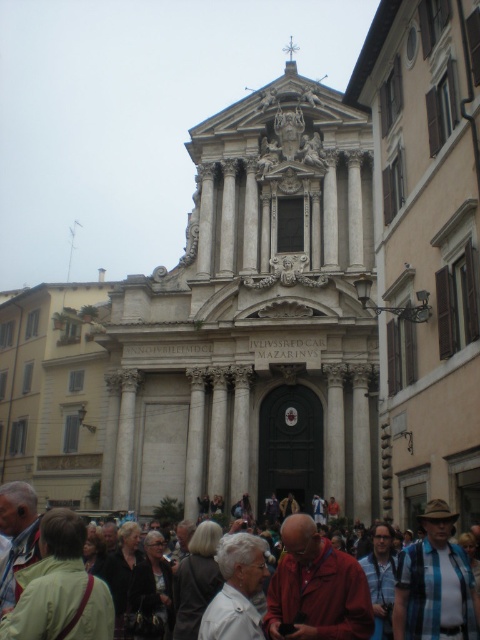
Question: Which of the following is the farthest from the observer?

Choices:
 (A) white textured jacket at center
 (B) white marble column at center

Answer: (B)

Question: Which point appears closest to the camera in this image?

Choices:
 (A) (266, 621)
 (B) (468, 589)
 (C) (179, 596)

Answer: (A)

Question: Can you confirm if blue plaid shirt at lower center is positioned above white fabric at center?

Choices:
 (A) yes
 (B) no

Answer: (A)

Question: Does blue plaid shirt at lower center appear under blue plaid shirt at center?

Choices:
 (A) yes
 (B) no

Answer: (B)

Question: Which point is closer to the camera?

Choices:
 (A) (432, 560)
 (B) (136, 557)

Answer: (A)

Question: In this image, where is dark gray sweater at center located relative to white marble column at center?

Choices:
 (A) below
 (B) above

Answer: (A)